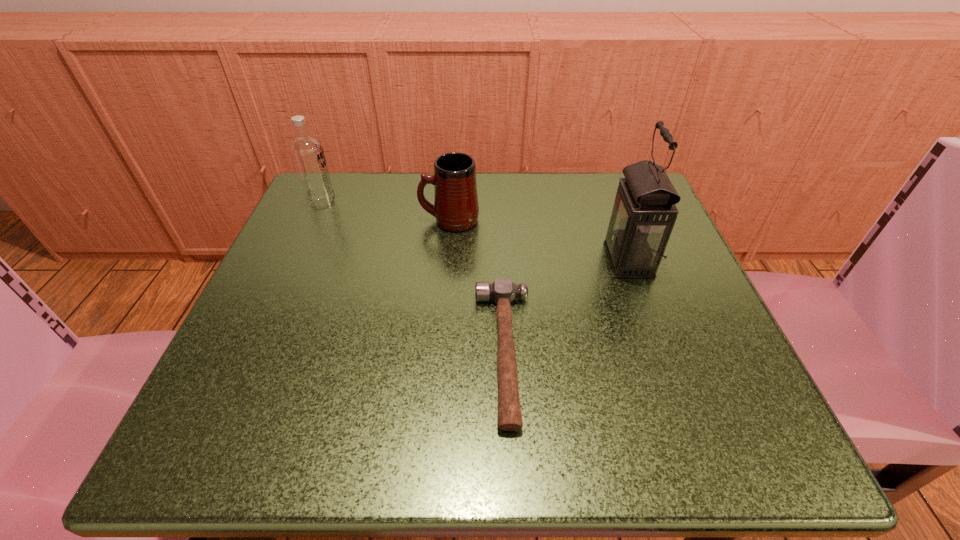
The image size is (960, 540). In order to click on the third farthest object in this screenshot , I will do `click(644, 213)`.

Image resolution: width=960 pixels, height=540 pixels. Identify the location of lantern. (644, 213).

The height and width of the screenshot is (540, 960). Identify the location of vodka. (307, 152).

The height and width of the screenshot is (540, 960). I want to click on the third shortest object, so click(x=307, y=152).

Locate an element on the screen. the second shortest object is located at coordinates (456, 208).

Find the location of a particular element. hammer is located at coordinates (502, 291).

The width and height of the screenshot is (960, 540). I want to click on the nearest object, so click(x=502, y=291).

Locate an element on the screen. blank space located 0.250m on the front-facing side of the rightmost object is located at coordinates (469, 260).

Where is `vacant region located on the front-facing side of the rightmost object`? vacant region located on the front-facing side of the rightmost object is located at coordinates (513, 260).

At what (x,y) coordinates should I click in order to perform the action: click on free region located 0.200m on the front-facing side of the rightmost object. Please return your answer as a coordinate pair (x, y). Looking at the image, I should click on (496, 260).